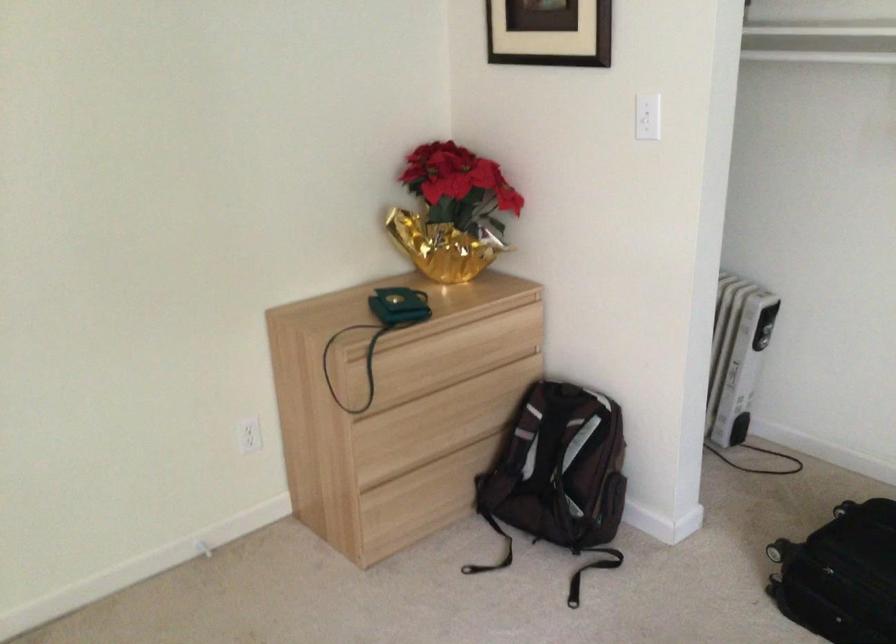
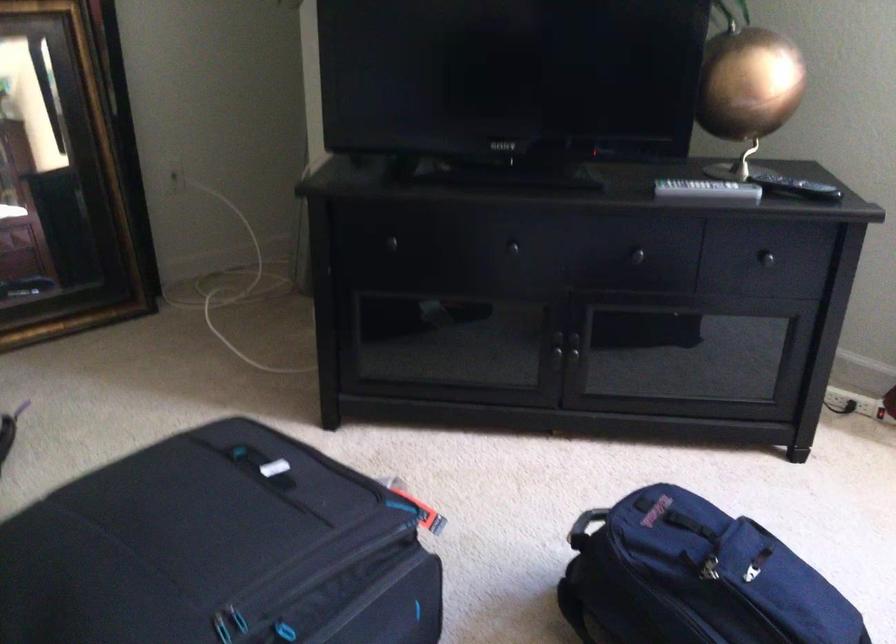
How did the camera likely rotate?

The rotation direction of the camera is right-down.